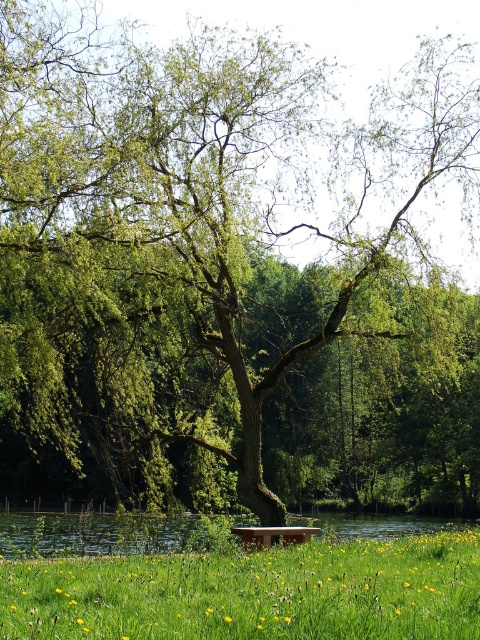
Question: Which object appears closest to the camera in this image?

Choices:
 (A) wooden bench at center
 (B) green grassy at lower center
 (C) green grassy river at lower center

Answer: (B)

Question: Does green grassy river at lower center have a lesser width compared to wooden bench at center?

Choices:
 (A) yes
 (B) no

Answer: (B)

Question: Among these objects, which one is farthest from the camera?

Choices:
 (A) green grassy at lower center
 (B) green grassy river at lower center

Answer: (B)

Question: Which of the following is the farthest from the observer?

Choices:
 (A) (272, 536)
 (B) (132, 547)
 (C) (12, 625)

Answer: (B)

Question: Does green grassy river at lower center appear under wooden bench at center?

Choices:
 (A) no
 (B) yes

Answer: (B)

Question: Can you confirm if green grassy river at lower center is positioned below wooden bench at center?

Choices:
 (A) no
 (B) yes

Answer: (B)